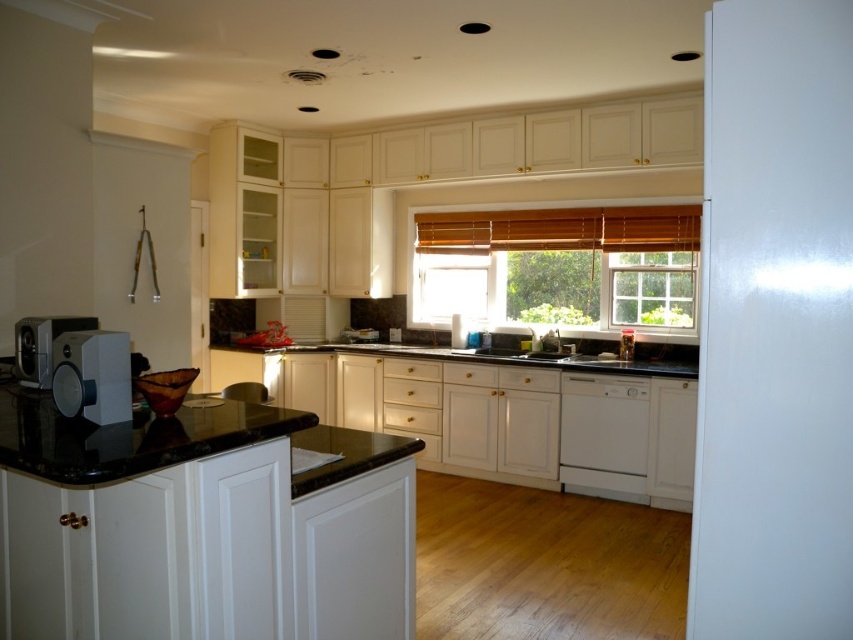
Question: Can you confirm if white matte dishwasher at lower center is positioned to the left of matte silver speaker at left?

Choices:
 (A) no
 (B) yes

Answer: (A)

Question: Which point is farther to the camera?

Choices:
 (A) (128, 374)
 (B) (73, 326)
 (C) (503, 352)

Answer: (C)

Question: Which of the following is the closest to the observer?

Choices:
 (A) white glossy sink at center
 (B) satin white toaster at left
 (C) wooden blinds at center
 (D) matte silver speaker at left

Answer: (B)

Question: From the image, what is the correct spatial relationship of matte silver speaker at left in relation to white glossy sink at center?

Choices:
 (A) below
 (B) above

Answer: (B)

Question: Which of these objects is positioned closest to the white glossy sink at center?

Choices:
 (A) satin white toaster at left
 (B) matte silver speaker at left
 (C) white matte dishwasher at lower center
 (D) wooden blinds at center

Answer: (C)

Question: Is wooden blinds at center thinner than matte silver speaker at left?

Choices:
 (A) no
 (B) yes

Answer: (A)